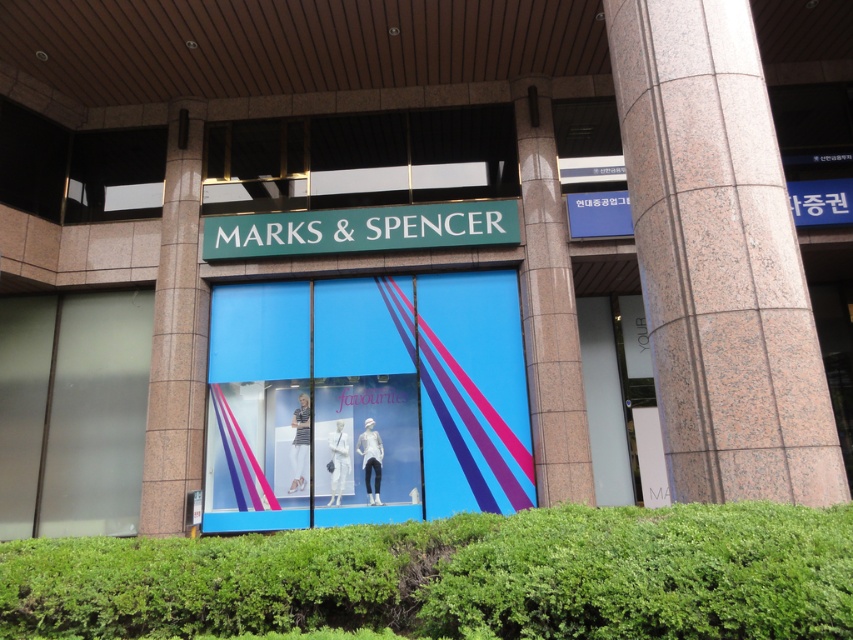
Does granite column at right have a lesser width compared to transparent glass door at right?

In fact, granite column at right might be wider than transparent glass door at right.

The width and height of the screenshot is (853, 640). Describe the element at coordinates (718, 259) in the screenshot. I see `granite column at right` at that location.

Where is `granite column at right`? The image size is (853, 640). granite column at right is located at coordinates (718, 259).

Between blue glass shop window at center and transparent glass door at right, which one appears on the right side from the viewer's perspective?

Positioned to the right is transparent glass door at right.

Is point (474, 362) closer to camera compared to point (651, 477)?

Yes.

The width and height of the screenshot is (853, 640). What are the coordinates of `blue glass shop window at center` in the screenshot? It's located at (367, 401).

Which is more to the right, green leafy hedge at lower center or blue glass shop window at center?

green leafy hedge at lower center is more to the right.

Which of these two, green leafy hedge at lower center or blue glass shop window at center, stands taller?

blue glass shop window at center

Where is `green leafy hedge at lower center`? green leafy hedge at lower center is located at coordinates (457, 577).